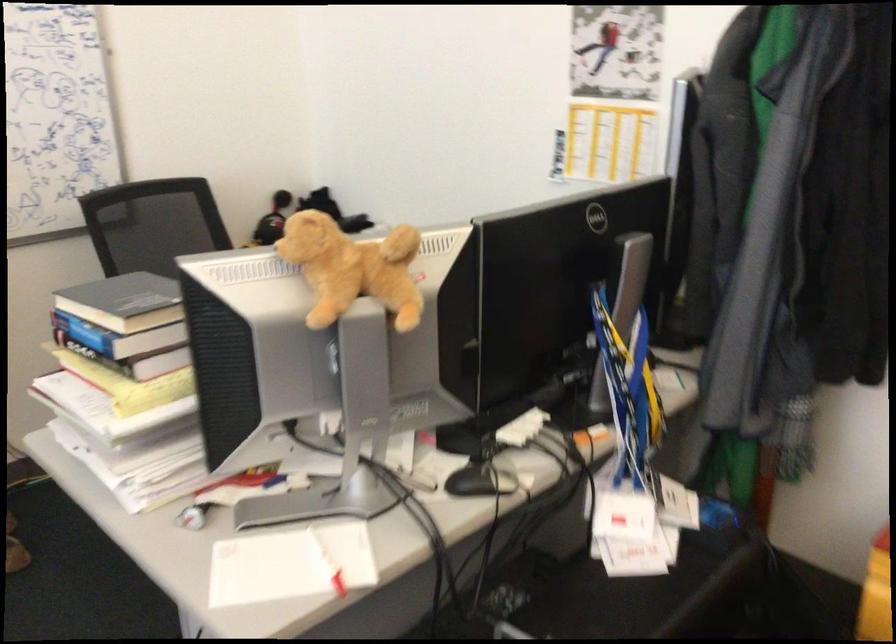
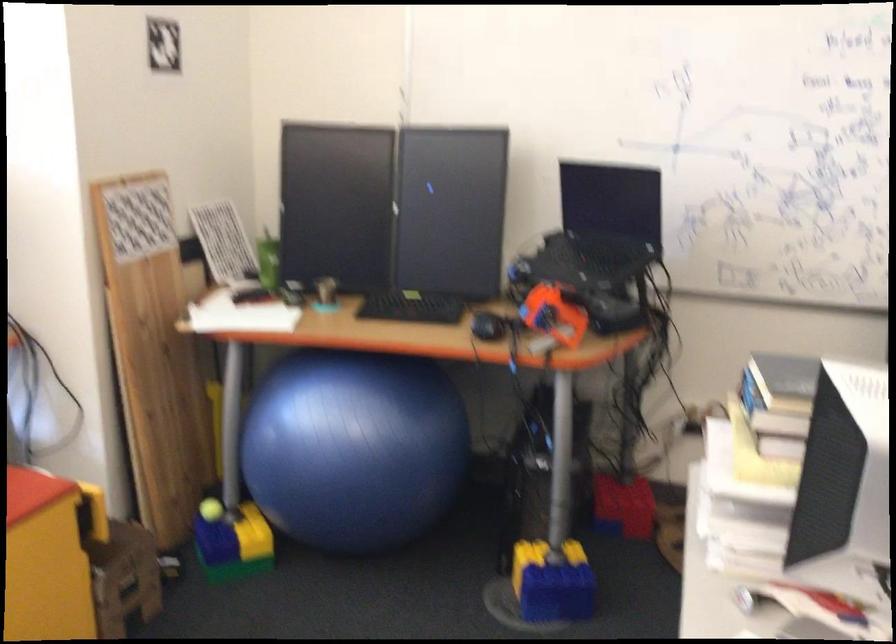
Find the pixel in the second image that matches pixel 116 317 in the first image.

(778, 402)